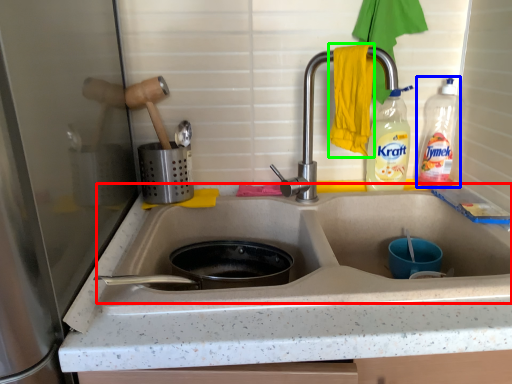
Question: Which object is positioned farthest from sink (highlighted by a red box)? Select from bottle (highlighted by a blue box) and hand towel (highlighted by a green box).

Choices:
 (A) bottle
 (B) hand towel

Answer: (A)